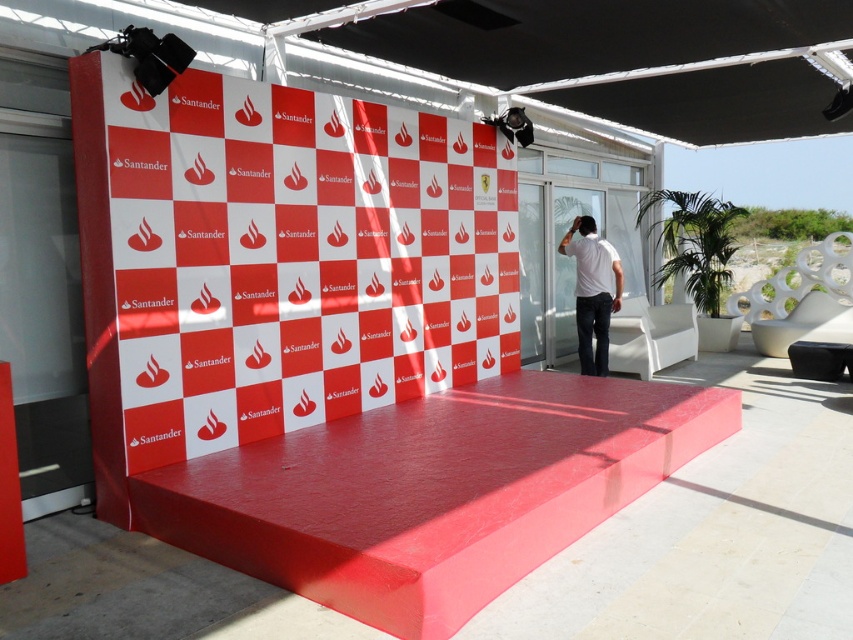
Is smooth red ramp at center taller than matte white canopy at upper center?

Indeed, smooth red ramp at center has a greater height compared to matte white canopy at upper center.

Is smooth red ramp at center shorter than matte white canopy at upper center?

No.

Between point (347, 576) and point (851, 1), which one is positioned behind?

Point (851, 1)

Where is `smooth red ramp at center`? smooth red ramp at center is located at coordinates (432, 492).

From the picture: Is matte white canopy at upper center to the left of white matte shirt at center from the viewer's perspective?

Indeed, matte white canopy at upper center is positioned on the left side of white matte shirt at center.

Can you confirm if matte white canopy at upper center is positioned above white matte shirt at center?

Indeed, matte white canopy at upper center is positioned over white matte shirt at center.

Between point (764, 60) and point (602, 298), which one is positioned in front?

Point (764, 60) is more forward.

Image resolution: width=853 pixels, height=640 pixels. Identify the location of matte white canopy at upper center. (624, 58).

The image size is (853, 640). What are the coordinates of `smooth red ramp at center` in the screenshot? It's located at (432, 492).

Who is more forward, [605,515] or [596,268]?

Point [605,515] is more forward.

Identify the location of smooth red ramp at center. Image resolution: width=853 pixels, height=640 pixels. (432, 492).